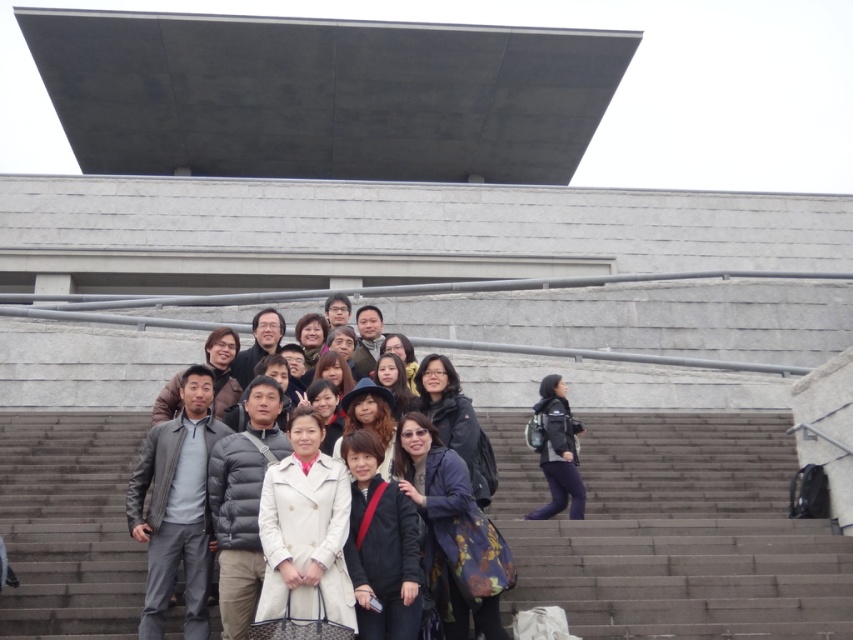
Is white down jacket at center below matte black glasses at center?

Yes, white down jacket at center is below matte black glasses at center.

Is point (244, 561) closer to camera compared to point (341, 298)?

Yes, point (244, 561) is in front of point (341, 298).

Where is `white down jacket at center`? white down jacket at center is located at coordinates (242, 502).

Does dark blue textured coat at center appear on the right side of matte black glasses at center?

Correct, you'll find dark blue textured coat at center to the right of matte black glasses at center.

Between dark blue textured coat at center and matte black glasses at center, which one appears on the left side from the viewer's perspective?

matte black glasses at center is more to the left.

Between point (447, 564) and point (341, 292), which one is positioned behind?

The point (341, 292) is behind.

Find the location of `dark blue textured coat at center`. dark blue textured coat at center is located at coordinates (442, 524).

Between dark blue fabric jacket at right and matte black glasses at center, which one appears on the right side from the viewer's perspective?

dark blue fabric jacket at right

Which is behind, point (573, 472) or point (326, 317)?

Point (326, 317)

Is point (563, 385) positioned behind point (335, 294)?

No, it is not.

Where is `dark blue fabric jacket at right`? dark blue fabric jacket at right is located at coordinates (558, 451).